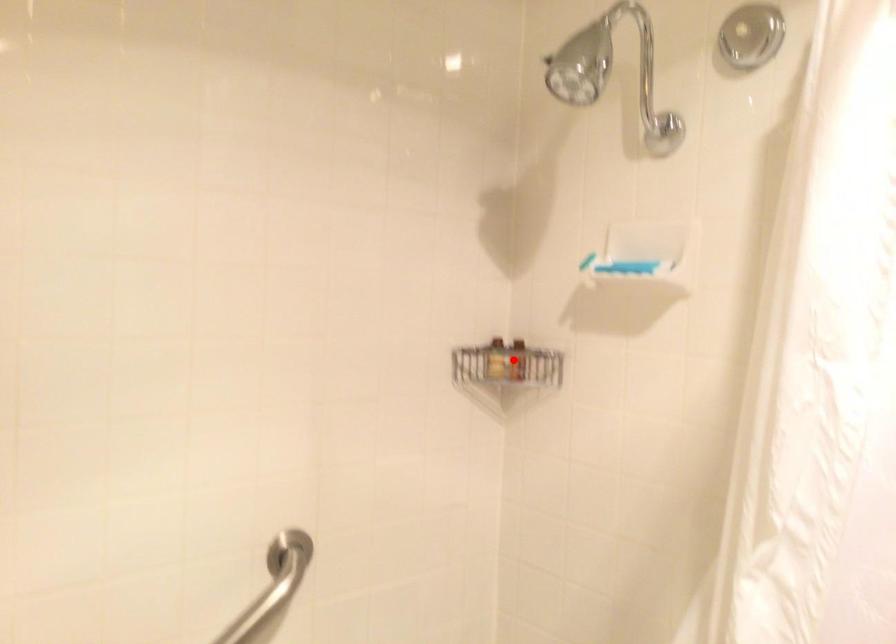
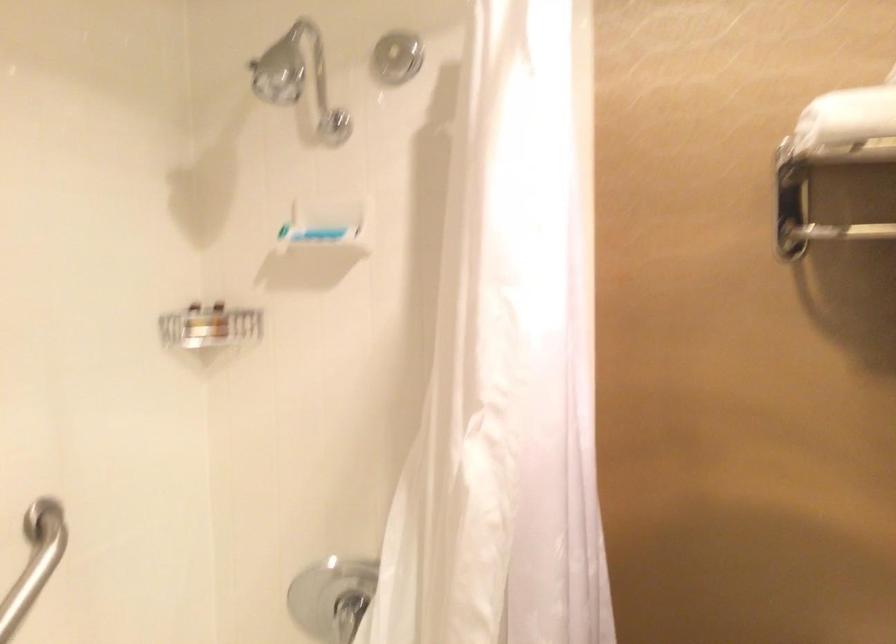
Find the pixel in the second image that matches the highlighted location in the first image.

(218, 321)